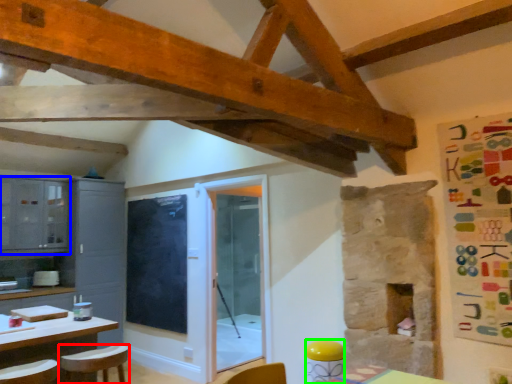
Question: Which object is positioned farthest from chair (highlighted by a red box)? Select from cabinetry (highlighted by a blue box) and bar stool (highlighted by a green box).

Choices:
 (A) cabinetry
 (B) bar stool

Answer: (A)